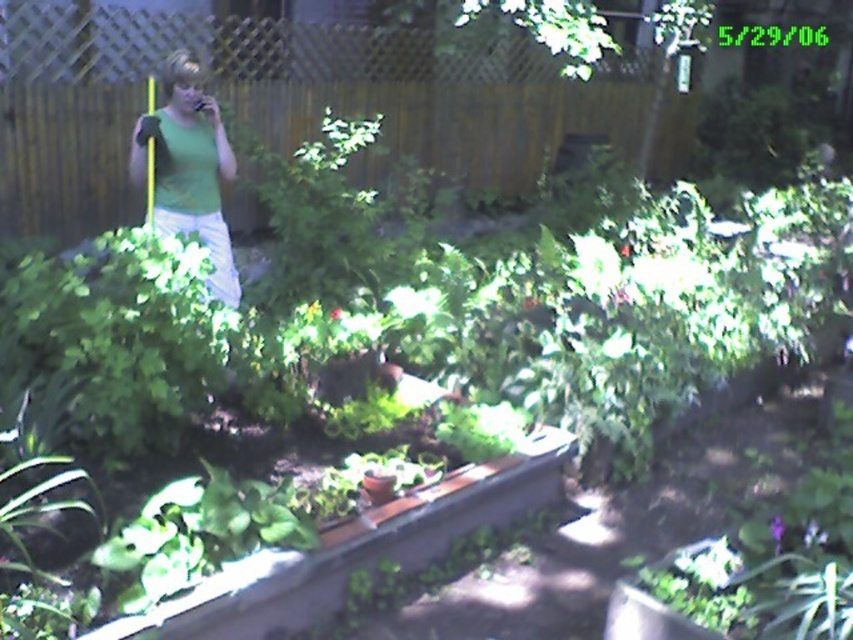
You are standing in the garden and see the green leafy plant at center. What are its coordinates?

The green leafy plant at center is located at coordinates point (357, 550).

You are a photographer aiming to capture the green leafy plant at lower right without the green matte shirt at upper left blocking the view. Is this possible based on their positions?

The green matte shirt at upper left is further to the viewer than the green leafy plant at lower right, so adjusting your position or angle might allow you to capture the plant without the shirt blocking it.

You are a gardener standing in the garden scene. You need to move from your current position near the green matte shirt at upper left to the green leafy plant at lower right. Can you walk directly to it without stepping on any plants or garden beds?

The distance between the green matte shirt at upper left and the green leafy plant at lower right is 9.28 feet. Since there is a clear path through the garden, you can walk directly to the plant without stepping on any plants or garden beds.